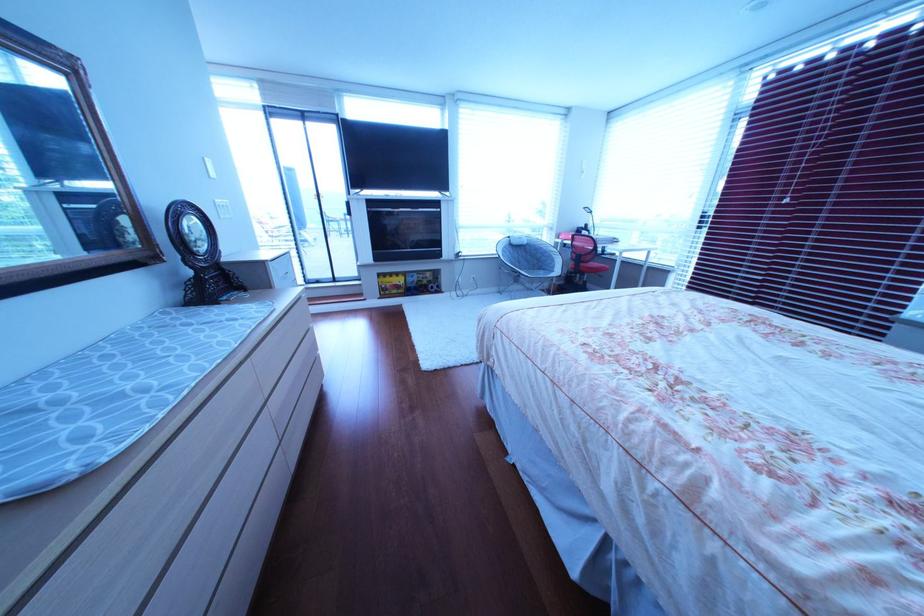
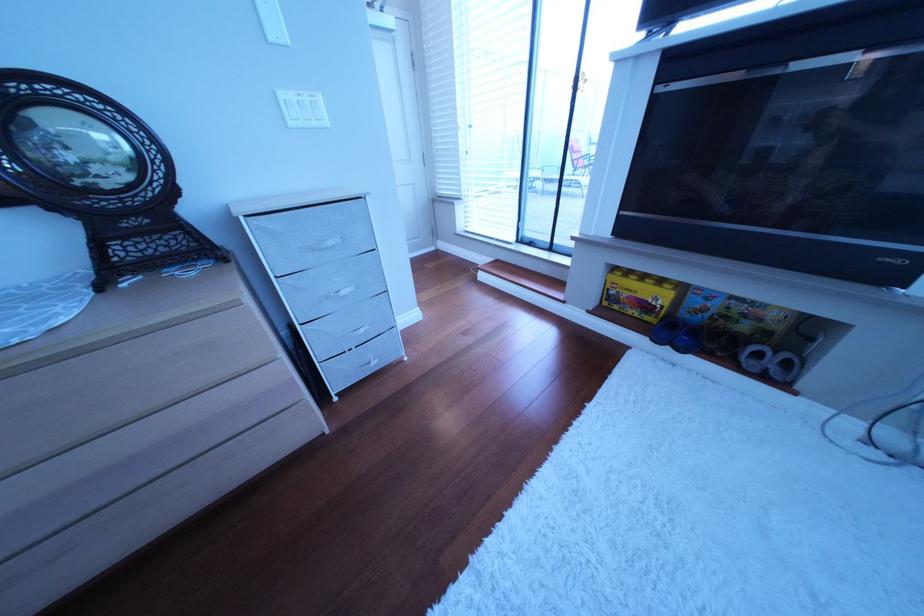
Where in the second image is the point corresponding to point 405,286 from the first image?

(640, 296)